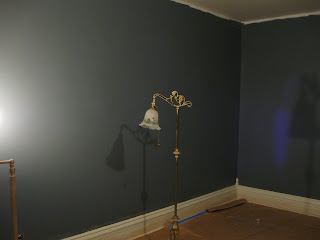
Where is `ceiling`? Image resolution: width=320 pixels, height=240 pixels. ceiling is located at coordinates point(292,11).